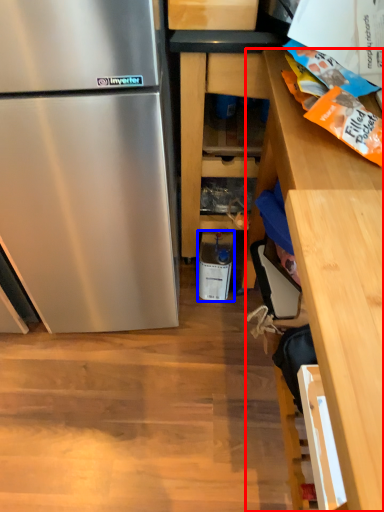
Question: Among these objects, which one is nearest to the camera, cabinetry (highlighted by a red box) or appliance (highlighted by a blue box)?

Choices:
 (A) cabinetry
 (B) appliance

Answer: (A)